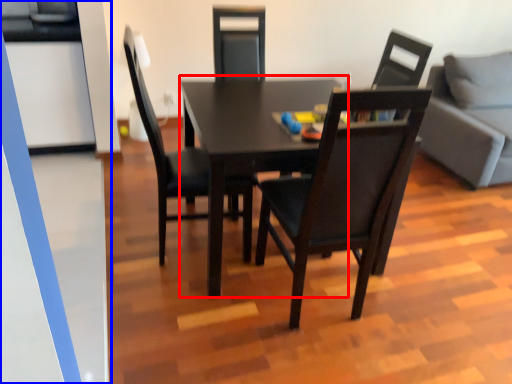
Question: Which object appears closest to the camera in this image, table (highlighted by a red box) or glass door (highlighted by a blue box)?

Choices:
 (A) table
 (B) glass door

Answer: (B)